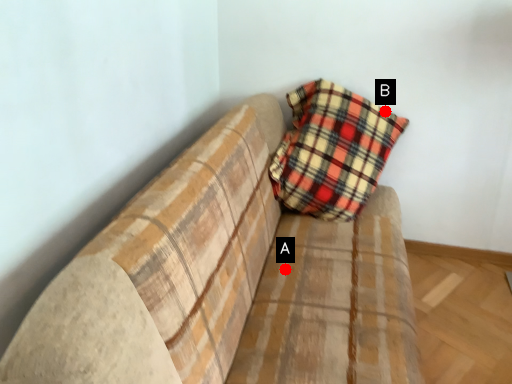
Question: Two points are circled on the image, labeled by A and B beside each circle. Which point is farther to the camera?

Choices:
 (A) A is further
 (B) B is further

Answer: (B)